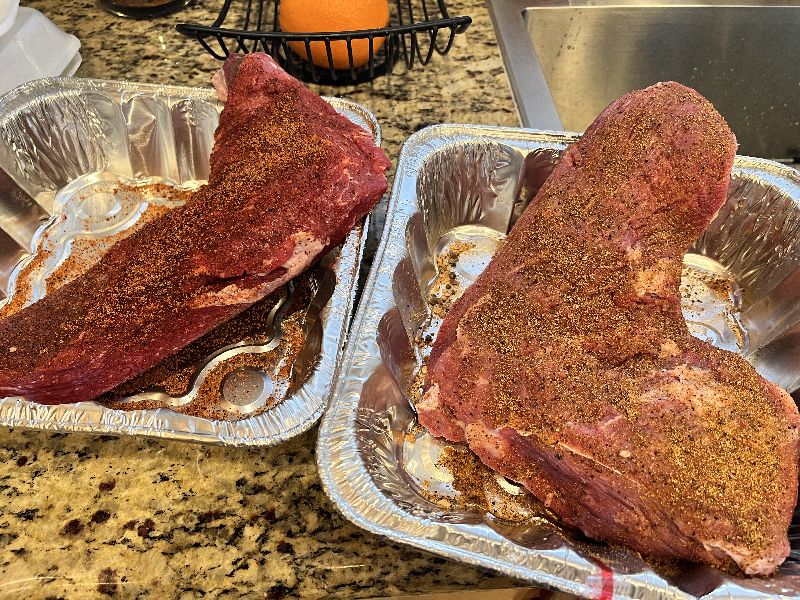
I want to click on metal basket, so click(x=217, y=32).